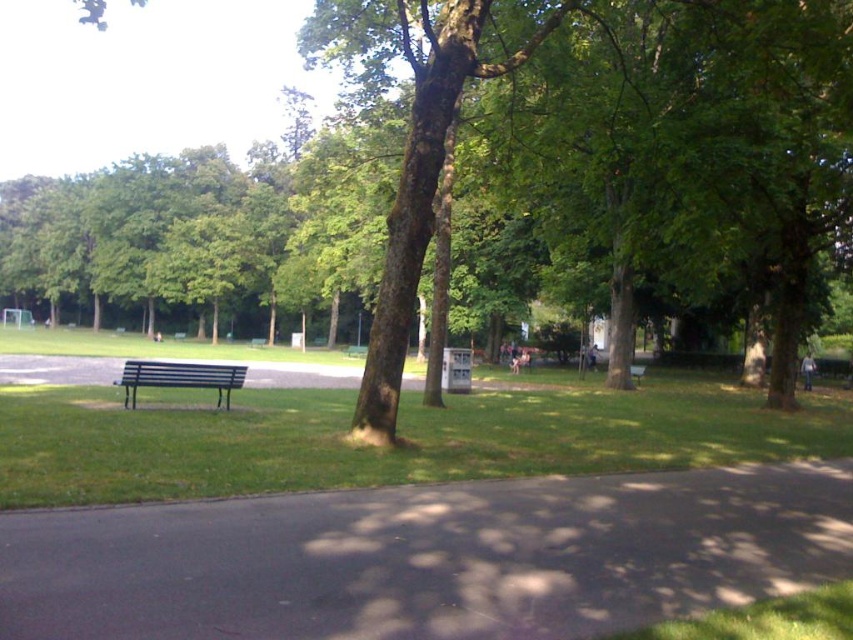
Between wooden park bench at center and metallic silver bench at center, which one has more height?

With more height is wooden park bench at center.

Is wooden park bench at center bigger than metallic silver bench at center?

Yes.

Does point (633, 381) lie in front of point (361, 352)?

That is True.

Find the location of a particular element. The image size is (853, 640). wooden park bench at center is located at coordinates (636, 372).

The image size is (853, 640). Describe the element at coordinates (502, 179) in the screenshot. I see `brown textured tree at center` at that location.

Identify the location of brown textured tree at center. The image size is (853, 640). (502, 179).

Between brown textured tree at center and wooden park bench at center, which one is positioned higher?

brown textured tree at center is above.

Does point (648, 148) come farther from viewer compared to point (634, 376)?

No.

What are the coordinates of `brown textured tree at center` in the screenshot? It's located at (502, 179).